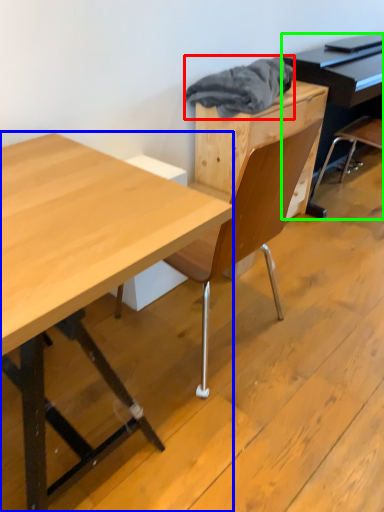
Question: Based on their relative distances, which object is farther from material (highlighted by a red box)? Choose from desk (highlighted by a blue box) and piano (highlighted by a green box).

Choices:
 (A) desk
 (B) piano

Answer: (A)